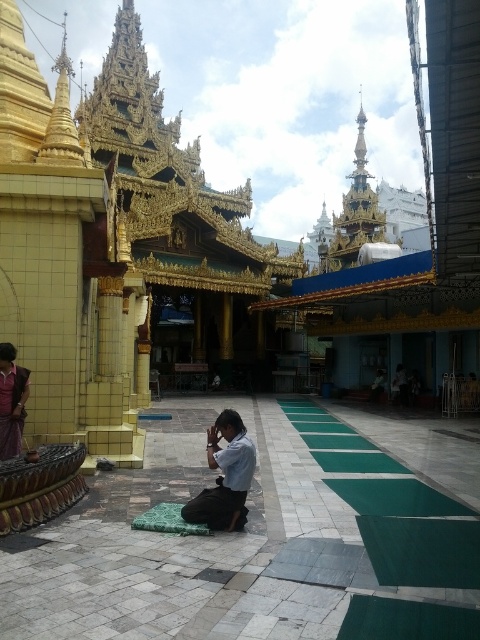
You are a photographer planning to capture a shot of the temple courtyard. You notice the light blue fabric at center and the matte purple shirt at left. Based on their positions, which object should you focus on first to ensure both are in frame without moving the camera?

The light blue fabric at center is wider than the matte purple shirt at left, so you should focus on the light blue fabric at center first to ensure it fits within the frame since it requires more space.

You are standing in the temple courtyard and want to take a photo of both the person kneeling on the green mat and the intricate golden spires in the background. Which of the two points, point (204, 518) or point (6, 356), is closer to your camera lens?

Point (204, 518) is closer to the camera lens than point (6, 356).

You are a visitor standing at the entrance of the temple courtyard. You see the light blue fabric at center and the matte purple shirt at left. Which object is farther away from you?

The light blue fabric at center is 59.39 feet away from the matte purple shirt at left, so the light blue fabric at center is farther away from you than the matte purple shirt at left.